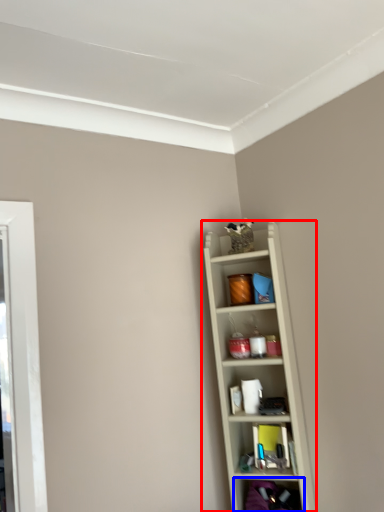
Question: Which of the following is the closest to the observer, shelf (highlighted by a red box) or shelf (highlighted by a blue box)?

Choices:
 (A) shelf
 (B) shelf

Answer: (B)